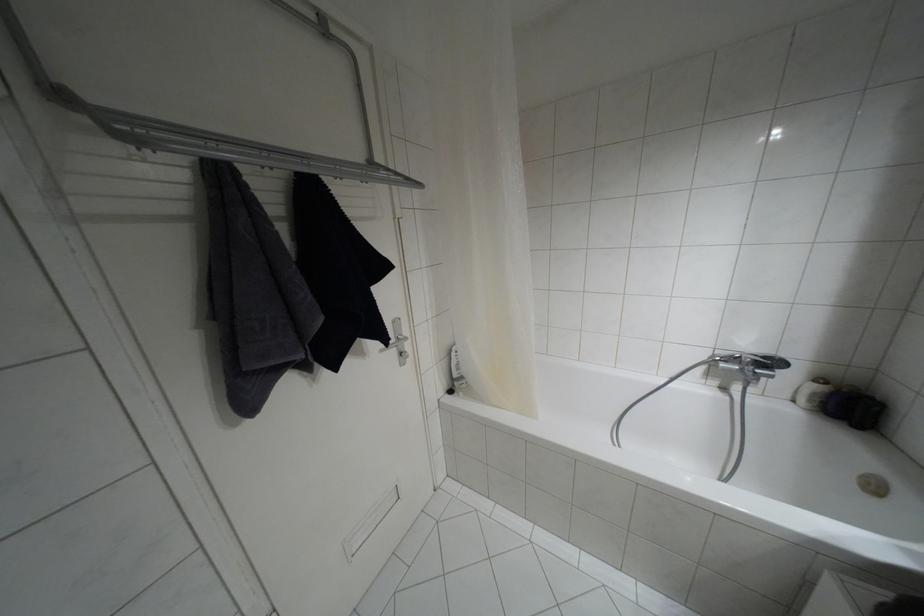
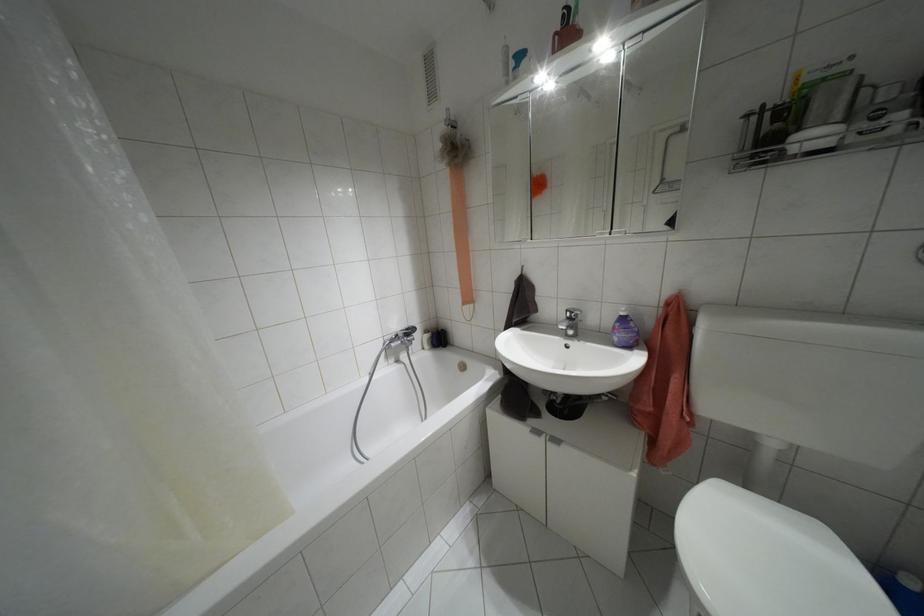
Question: The images are taken continuously from a first-person perspective. In which direction is your viewpoint rotating?

Choices:
 (A) Left
 (B) Right
 (C) Up
 (D) Down

Answer: (B)